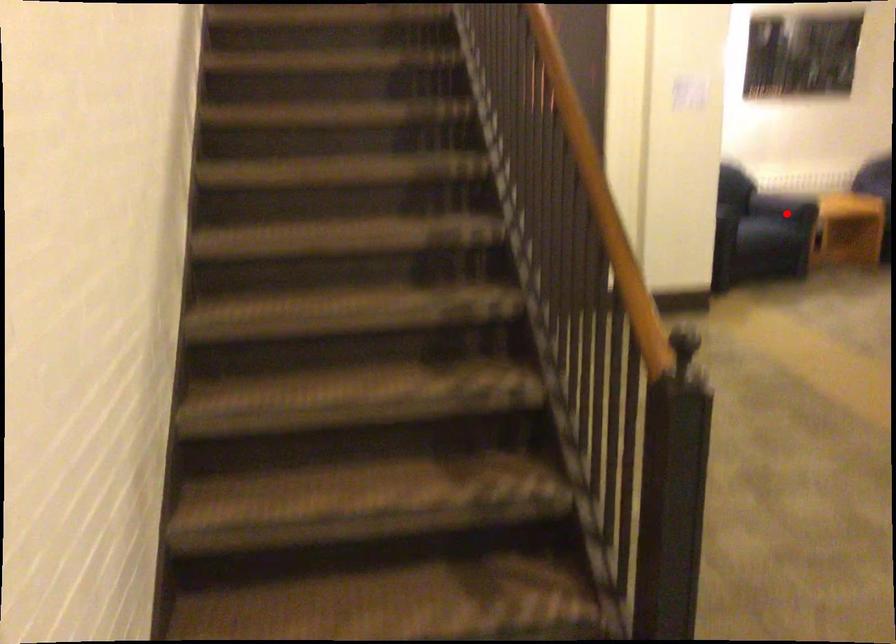
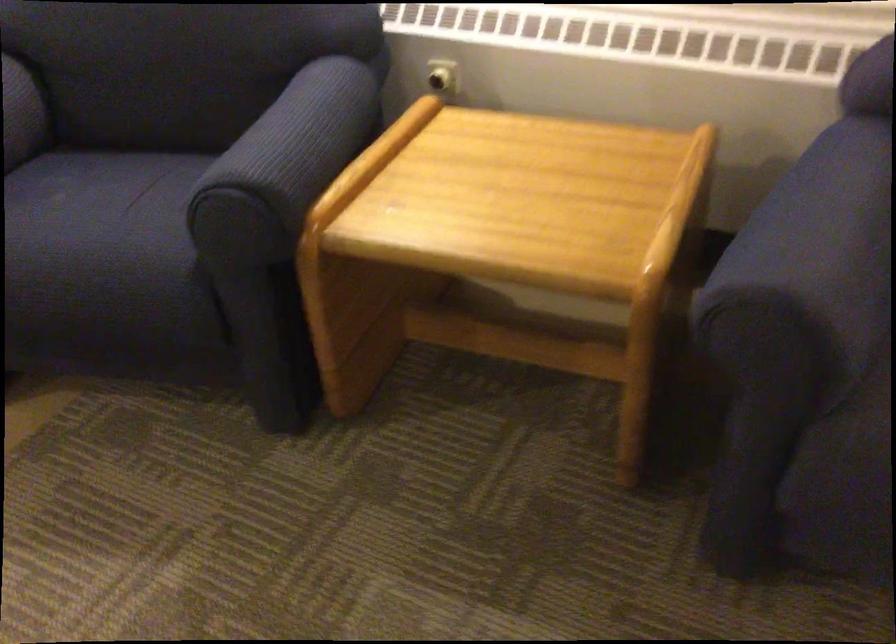
Question: I am providing you with two images of the same scene from different viewpoints. A red point is marked on the first image. Can you still see the location of the red point in image 2?

Choices:
 (A) Yes
 (B) No

Answer: (A)